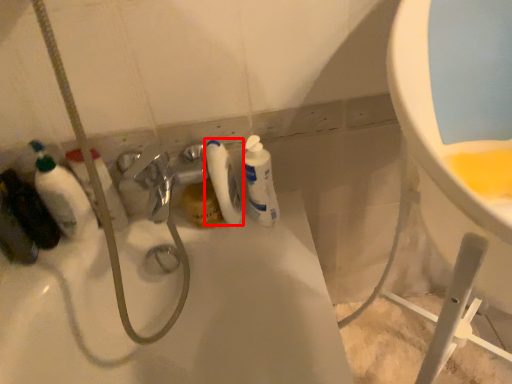
Question: From the image's perspective, where is cleaning product (annotated by the red box) located in relation to cleaning product in the image?

Choices:
 (A) above
 (B) below

Answer: (A)